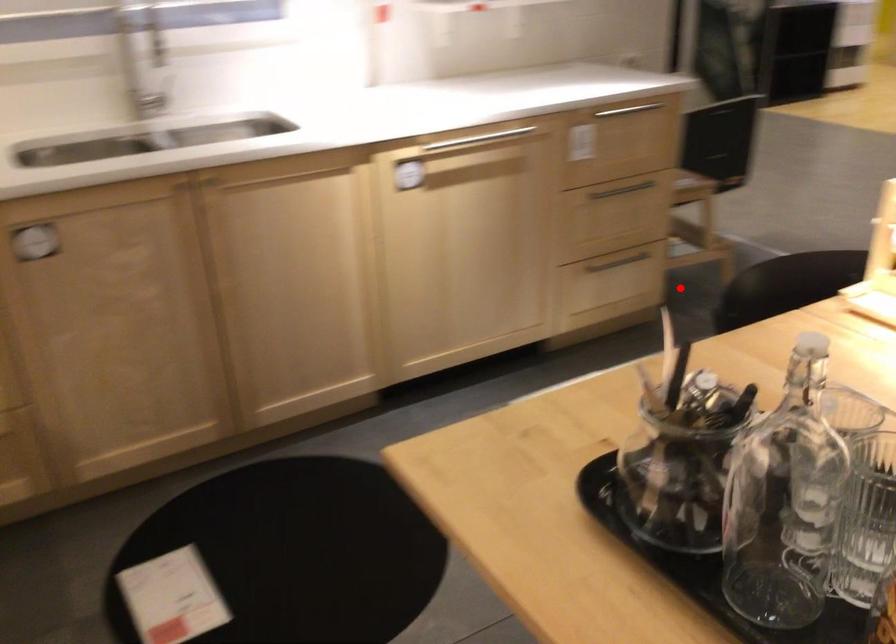
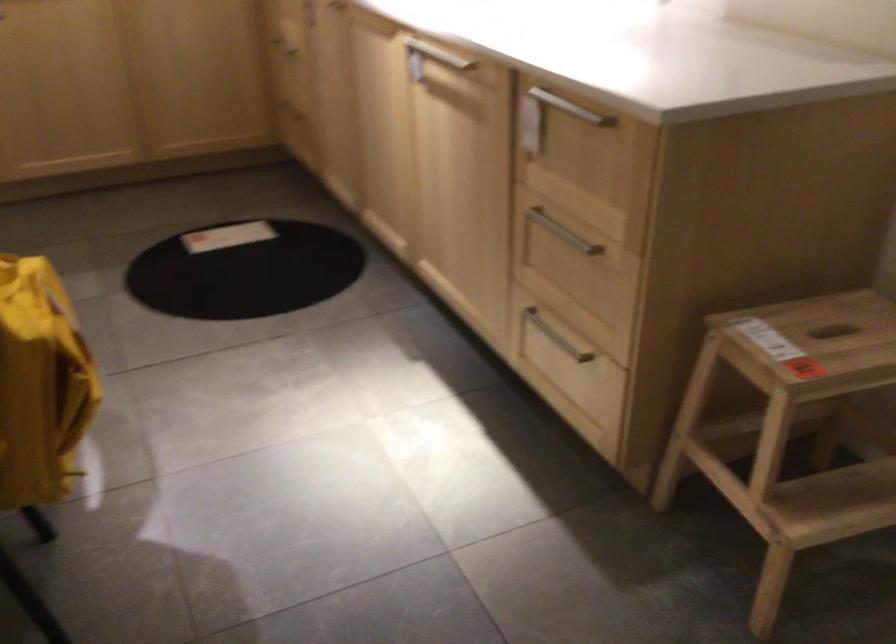
In the second image, find the point that corresponds to the highlighted location in the first image.

(739, 527)